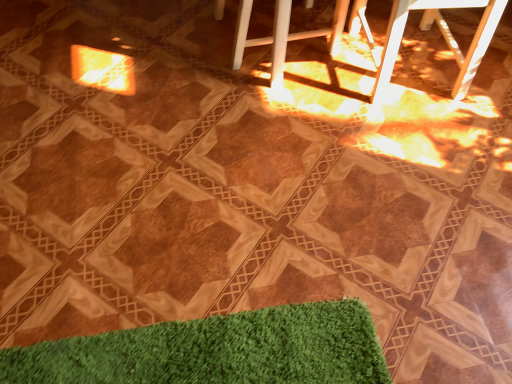
Locate an element on the screen. white plastic bar stool at center, marked as the 2th bar stool in a right-to-left arrangement is located at coordinates (283, 35).

This screenshot has width=512, height=384. Describe the element at coordinates (283, 35) in the screenshot. I see `white plastic bar stool at center, marked as the 2th bar stool in a right-to-left arrangement` at that location.

Identify the location of white plastic bar stool at upper right, placed as the second bar stool when sorted from left to right. (443, 36).

The width and height of the screenshot is (512, 384). Describe the element at coordinates (443, 36) in the screenshot. I see `white plastic bar stool at upper right, placed as the second bar stool when sorted from left to right` at that location.

Image resolution: width=512 pixels, height=384 pixels. Find the location of `white plastic bar stool at center, marked as the 2th bar stool in a right-to-left arrangement`. white plastic bar stool at center, marked as the 2th bar stool in a right-to-left arrangement is located at coordinates (283, 35).

Can you confirm if white plastic bar stool at center, the first bar stool positioned from the left, is positioned to the right of white plastic bar stool at upper right, which is the first bar stool from right to left?

No.

Between white plastic bar stool at center, marked as the 2th bar stool in a right-to-left arrangement, and white plastic bar stool at upper right, placed as the second bar stool when sorted from left to right, which one is positioned in front?

Positioned in front is white plastic bar stool at upper right, placed as the second bar stool when sorted from left to right.

Does point (337, 30) appear closer or farther from the camera than point (455, 6)?

Point (337, 30) is positioned farther from the camera compared to point (455, 6).

From the picture: From the image's perspective, which object appears higher, white plastic bar stool at center, marked as the 2th bar stool in a right-to-left arrangement, or white plastic bar stool at upper right, which is the first bar stool from right to left?

From the image's view, white plastic bar stool at center, marked as the 2th bar stool in a right-to-left arrangement, is above.

From a real-world perspective, relative to white plastic bar stool at upper right, placed as the second bar stool when sorted from left to right, is white plastic bar stool at center, the first bar stool positioned from the left, vertically above or below?

white plastic bar stool at center, the first bar stool positioned from the left, is below white plastic bar stool at upper right, placed as the second bar stool when sorted from left to right.

In terms of width, does white plastic bar stool at center, marked as the 2th bar stool in a right-to-left arrangement, look wider or thinner when compared to white plastic bar stool at upper right, which is the first bar stool from right to left?

white plastic bar stool at center, marked as the 2th bar stool in a right-to-left arrangement, is wider than white plastic bar stool at upper right, which is the first bar stool from right to left.

Does white plastic bar stool at center, the first bar stool positioned from the left, have a greater height compared to white plastic bar stool at upper right, which is the first bar stool from right to left?

Incorrect, the height of white plastic bar stool at center, the first bar stool positioned from the left, is not larger of that of white plastic bar stool at upper right, which is the first bar stool from right to left.

Who is smaller, white plastic bar stool at center, marked as the 2th bar stool in a right-to-left arrangement, or white plastic bar stool at upper right, which is the first bar stool from right to left?

Smaller between the two is white plastic bar stool at center, marked as the 2th bar stool in a right-to-left arrangement.

Is white plastic bar stool at center, the first bar stool positioned from the left, completely or partially outside of white plastic bar stool at upper right, which is the first bar stool from right to left?

Absolutely, white plastic bar stool at center, the first bar stool positioned from the left, is external to white plastic bar stool at upper right, which is the first bar stool from right to left.

Is white plastic bar stool at center, marked as the 2th bar stool in a right-to-left arrangement, positioned far away from white plastic bar stool at upper right, placed as the second bar stool when sorted from left to right?

No, white plastic bar stool at center, marked as the 2th bar stool in a right-to-left arrangement, is not far away from white plastic bar stool at upper right, placed as the second bar stool when sorted from left to right.

Is white plastic bar stool at center, marked as the 2th bar stool in a right-to-left arrangement, oriented away from white plastic bar stool at upper right, which is the first bar stool from right to left?

A: No, white plastic bar stool at center, marked as the 2th bar stool in a right-to-left arrangement,'s orientation is not away from white plastic bar stool at upper right, which is the first bar stool from right to left.

What's the angular difference between white plastic bar stool at center, marked as the 2th bar stool in a right-to-left arrangement, and white plastic bar stool at upper right, which is the first bar stool from right to left,'s facing directions?

The angle between the facing direction of white plastic bar stool at center, marked as the 2th bar stool in a right-to-left arrangement, and the facing direction of white plastic bar stool at upper right, which is the first bar stool from right to left, is 83.8 degrees.

Find the location of a particular element. bar stool below the white plastic bar stool at upper right, which is the first bar stool from right to left (from a real-world perspective) is located at coordinates (283, 35).

Which object is positioned more to the left, white plastic bar stool at upper right, which is the first bar stool from right to left, or white plastic bar stool at center, the first bar stool positioned from the left?

Positioned to the left is white plastic bar stool at center, the first bar stool positioned from the left.

Is white plastic bar stool at upper right, placed as the second bar stool when sorted from left to right, in front of white plastic bar stool at center, marked as the 2th bar stool in a right-to-left arrangement?

Yes.

Which is less distant, (389, 40) or (244, 15)?

The point (244, 15) is closer to the camera.

From the image's perspective, between white plastic bar stool at upper right, which is the first bar stool from right to left, and white plastic bar stool at center, the first bar stool positioned from the left, who is located below?

white plastic bar stool at upper right, which is the first bar stool from right to left, is shown below in the image.

From a real-world perspective, who is located lower, white plastic bar stool at upper right, which is the first bar stool from right to left, or white plastic bar stool at center, marked as the 2th bar stool in a right-to-left arrangement?

white plastic bar stool at center, marked as the 2th bar stool in a right-to-left arrangement.

Does white plastic bar stool at upper right, placed as the second bar stool when sorted from left to right, have a lesser width compared to white plastic bar stool at center, marked as the 2th bar stool in a right-to-left arrangement?

Correct, the width of white plastic bar stool at upper right, placed as the second bar stool when sorted from left to right, is less than that of white plastic bar stool at center, marked as the 2th bar stool in a right-to-left arrangement.

Considering the relative sizes of white plastic bar stool at upper right, which is the first bar stool from right to left, and white plastic bar stool at center, the first bar stool positioned from the left, in the image provided, is white plastic bar stool at upper right, which is the first bar stool from right to left, taller than white plastic bar stool at center, the first bar stool positioned from the left,?

Indeed, white plastic bar stool at upper right, which is the first bar stool from right to left, has a greater height compared to white plastic bar stool at center, the first bar stool positioned from the left.

Does white plastic bar stool at upper right, placed as the second bar stool when sorted from left to right, have a larger size compared to white plastic bar stool at center, the first bar stool positioned from the left?

Indeed, white plastic bar stool at upper right, placed as the second bar stool when sorted from left to right, has a larger size compared to white plastic bar stool at center, the first bar stool positioned from the left.

Looking at this image, is white plastic bar stool at center, marked as the 2th bar stool in a right-to-left arrangement, surrounded by white plastic bar stool at upper right, which is the first bar stool from right to left?

No, white plastic bar stool at center, marked as the 2th bar stool in a right-to-left arrangement, is located outside of white plastic bar stool at upper right, which is the first bar stool from right to left.

Is white plastic bar stool at upper right, placed as the second bar stool when sorted from left to right, not near white plastic bar stool at center, marked as the 2th bar stool in a right-to-left arrangement?

white plastic bar stool at upper right, placed as the second bar stool when sorted from left to right, is near white plastic bar stool at center, marked as the 2th bar stool in a right-to-left arrangement, not far away.

In the scene shown: Is white plastic bar stool at upper right, placed as the second bar stool when sorted from left to right, facing away from white plastic bar stool at center, the first bar stool positioned from the left?

No, white plastic bar stool at upper right, placed as the second bar stool when sorted from left to right, is not facing the opposite direction of white plastic bar stool at center, the first bar stool positioned from the left.

Can you tell me how much white plastic bar stool at upper right, which is the first bar stool from right to left, and white plastic bar stool at center, the first bar stool positioned from the left, differ in facing direction?

They differ by 83.8 degrees in their facing directions.

Locate an element on the screen. This screenshot has height=384, width=512. bar stool on the right side of white plastic bar stool at center, the first bar stool positioned from the left is located at coordinates (443, 36).

This screenshot has width=512, height=384. In order to click on bar stool behind the white plastic bar stool at upper right, which is the first bar stool from right to left in this screenshot , I will do `click(283, 35)`.

You are a GUI agent. You are given a task and a screenshot of the screen. Output one action in this format:
    pyautogui.click(x=<x>, y=<y>)
    Task: Click on the bar stool above the white plastic bar stool at upper right, which is the first bar stool from right to left (from the image's perspective)
    
    Given the screenshot: What is the action you would take?
    pyautogui.click(x=283, y=35)